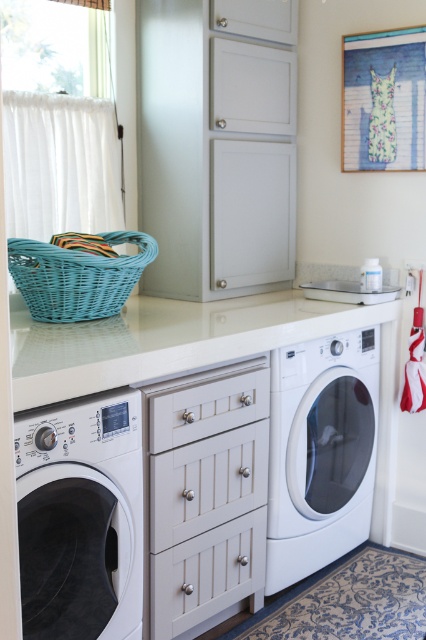
Question: Among these objects, which one is nearest to the camera?

Choices:
 (A) white glossy washing machine at lower right
 (B) white glossy washing machine at lower left

Answer: (B)

Question: Is white glossy washing machine at lower right positioned before teal wicker basket at upper left?

Choices:
 (A) no
 (B) yes

Answer: (A)

Question: Can you confirm if white glossy washing machine at lower left is bigger than white glossy washing machine at lower right?

Choices:
 (A) no
 (B) yes

Answer: (A)

Question: Which object is the farthest from the white glossy washing machine at lower left?

Choices:
 (A) teal wicker basket at upper left
 (B) white glossy washing machine at lower right

Answer: (B)

Question: Which object appears closest to the camera in this image?

Choices:
 (A) white glossy washing machine at lower left
 (B) white glossy washing machine at lower right

Answer: (A)

Question: Can you confirm if white glossy washing machine at lower left is positioned to the right of teal wicker basket at upper left?

Choices:
 (A) yes
 (B) no

Answer: (A)